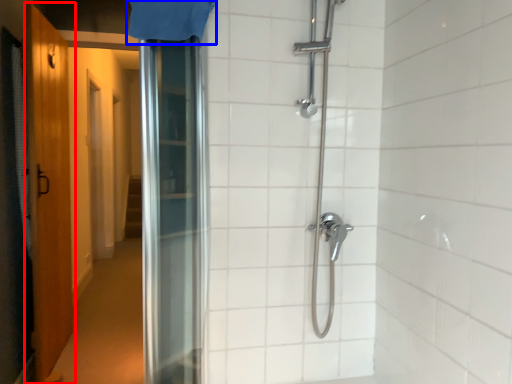
Question: Which object is closer to the camera taking this photo, door (highlighted by a red box) or shower curtain (highlighted by a blue box)?

Choices:
 (A) door
 (B) shower curtain

Answer: (B)